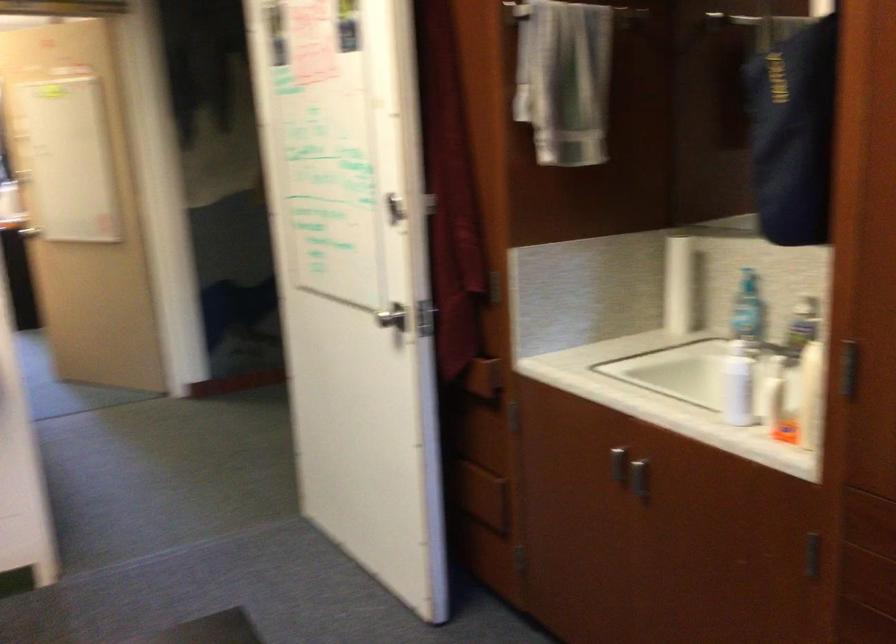
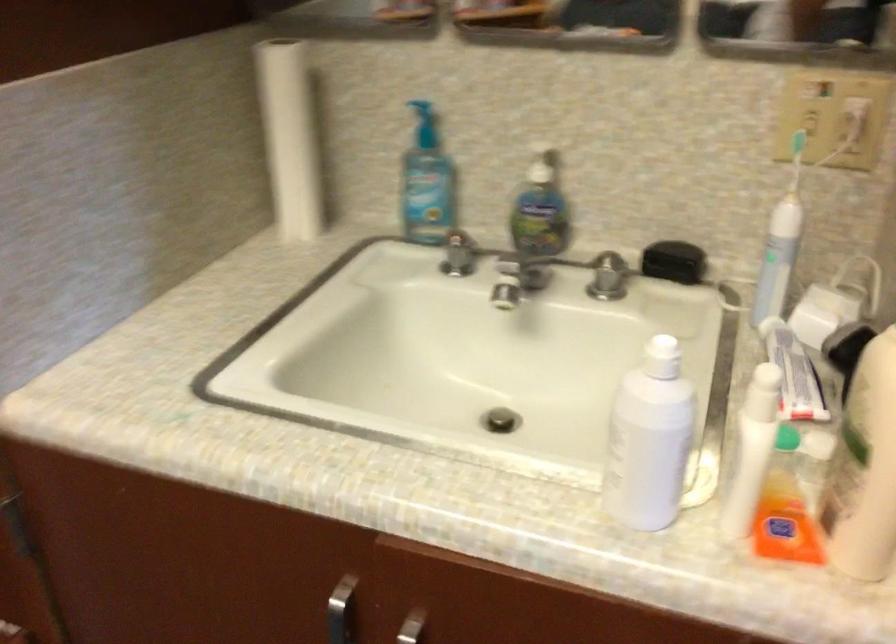
Find the pixel in the second image that matches [673,277] in the first image.

(289, 138)